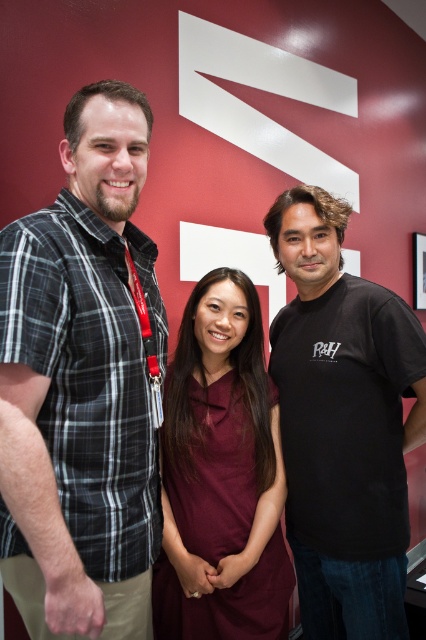
Which of these two, black matte t-shirt at center or maroon fabric dress at center, stands shorter?

maroon fabric dress at center

How much distance is there between black matte t-shirt at center and maroon fabric dress at center?

8.11 inches

This screenshot has height=640, width=426. What do you see at coordinates (342, 422) in the screenshot? I see `black matte t-shirt at center` at bounding box center [342, 422].

The image size is (426, 640). In order to click on black matte t-shirt at center in this screenshot , I will do `click(342, 422)`.

From the picture: Is plaid shirt at left taller than maroon fabric dress at center?

Correct, plaid shirt at left is much taller as maroon fabric dress at center.

Consider the image. Does plaid shirt at left lie behind maroon fabric dress at center?

No, it is not.

What do you see at coordinates (83, 385) in the screenshot?
I see `plaid shirt at left` at bounding box center [83, 385].

Where is `plaid shirt at left`? The image size is (426, 640). plaid shirt at left is located at coordinates (83, 385).

Is point (163, 358) closer to viewer compared to point (363, 342)?

Yes, point (163, 358) is closer to viewer.

Does plaid shirt at left appear on the right side of black matte t-shirt at center?

No, plaid shirt at left is not to the right of black matte t-shirt at center.

Is point (23, 580) closer to camera compared to point (368, 588)?

Yes, it is in front of point (368, 588).

Where is `plaid shirt at left`? The width and height of the screenshot is (426, 640). plaid shirt at left is located at coordinates (83, 385).